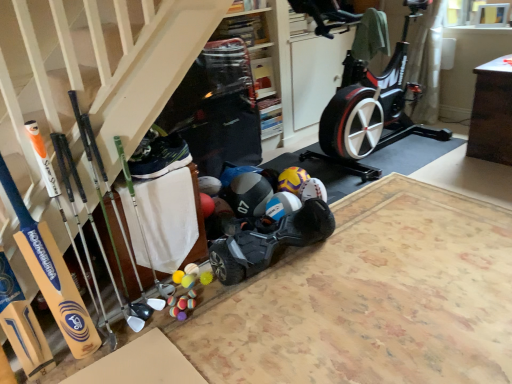
Question: Based on their positions, is black matte hoverboard at center located to the left or right of blue matte helmet at center?

Choices:
 (A) left
 (B) right

Answer: (B)

Question: From the image's perspective, is black matte hoverboard at center above or below blue matte helmet at center?

Choices:
 (A) above
 (B) below

Answer: (B)

Question: Considering the real-world distances, which object is farthest from the blue matte helmet at center?

Choices:
 (A) wooden stairs at lower left
 (B) black fabric shoe at center
 (C) black matte hoverboard at center

Answer: (A)

Question: Estimate the real-world distances between objects in this image. Which object is closer to the black matte hoverboard at center?

Choices:
 (A) blue matte helmet at center
 (B) wooden stairs at lower left
 (C) black fabric shoe at center

Answer: (A)